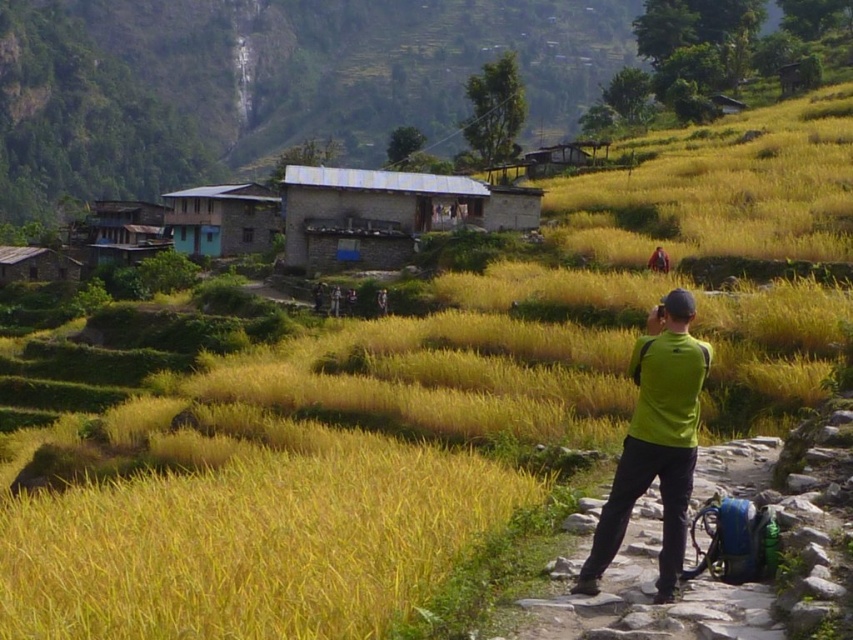
Can you confirm if green fabric bag at right is smaller than green fabric shirt at right?

Indeed, green fabric bag at right has a smaller size compared to green fabric shirt at right.

The image size is (853, 640). What do you see at coordinates (639, 593) in the screenshot?
I see `green fabric bag at right` at bounding box center [639, 593].

Which is in front, point (758, 456) or point (697, 376)?

Point (697, 376) is in front.

Where is `green fabric bag at right`? green fabric bag at right is located at coordinates (639, 593).

From the picture: Is stone brick house at center wider than green fabric bag at right?

Yes.

Is stone brick house at center above green fabric bag at right?

Indeed, stone brick house at center is positioned over green fabric bag at right.

Where is `stone brick house at center`? This screenshot has width=853, height=640. stone brick house at center is located at coordinates (312, 218).

The width and height of the screenshot is (853, 640). I want to click on stone brick house at center, so click(312, 218).

Is green fabric bag at right below blue painted wooden hut at center?

Yes, green fabric bag at right is below blue painted wooden hut at center.

Does green fabric bag at right lie behind blue painted wooden hut at center?

No, it is not.

Is point (576, 600) farther from viewer compared to point (189, 220)?

That is False.

Image resolution: width=853 pixels, height=640 pixels. I want to click on green fabric bag at right, so click(639, 593).